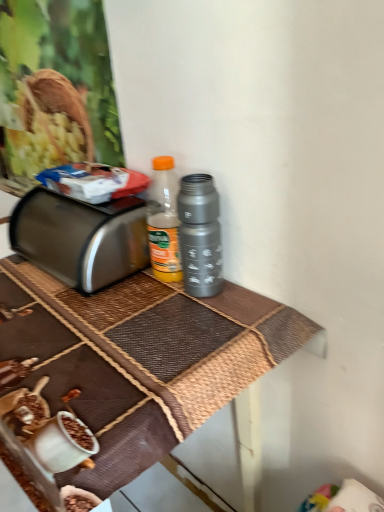
The width and height of the screenshot is (384, 512). What are the coordinates of `free space in front of satin silver toaster at left` in the screenshot? It's located at (77, 320).